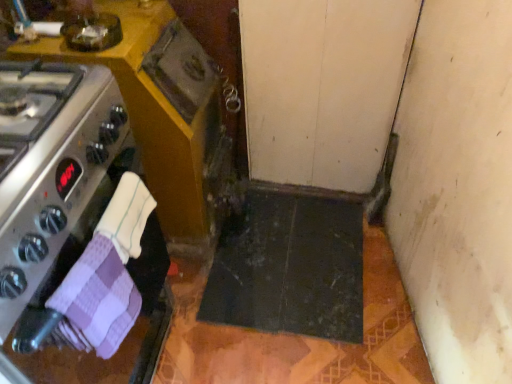
Question: Is matte wood cabinet at lower center at the left side of purple checkered cloth at left, arranged as the 2th hand towel when viewed from the top?

Choices:
 (A) yes
 (B) no

Answer: (A)

Question: Does matte wood cabinet at lower center have a lesser width compared to purple checkered cloth at left, arranged as the 2th hand towel when viewed from the top?

Choices:
 (A) no
 (B) yes

Answer: (A)

Question: Is matte wood cabinet at lower center taller than purple checkered cloth at left, arranged as the 2th hand towel when viewed from the top?

Choices:
 (A) yes
 (B) no

Answer: (A)

Question: Is purple checkered cloth at left, arranged as the 2th hand towel when viewed from the top, a part of matte wood cabinet at lower center?

Choices:
 (A) yes
 (B) no

Answer: (B)

Question: Is matte wood cabinet at lower center positioned in front of purple checkered cloth at left, arranged as the 2th hand towel when viewed from the top?

Choices:
 (A) yes
 (B) no

Answer: (B)

Question: Is matte wood cabinet at lower center turned away from purple checkered cloth at left, which ranks as the 1th hand towel in bottom-to-top order?

Choices:
 (A) yes
 (B) no

Answer: (B)

Question: Is white textured hand towel at lower left, the 1th hand towel from the top, far away from satin silver oven at left?

Choices:
 (A) yes
 (B) no

Answer: (B)

Question: Is white textured hand towel at lower left, the 1th hand towel from the top, in front of satin silver oven at left?

Choices:
 (A) no
 (B) yes

Answer: (A)

Question: Is white textured hand towel at lower left, which appears as the 2th hand towel when ordered from the bottom, beside satin silver oven at left?

Choices:
 (A) no
 (B) yes

Answer: (A)

Question: Is white textured hand towel at lower left, which appears as the 2th hand towel when ordered from the bottom, taller than satin silver oven at left?

Choices:
 (A) yes
 (B) no

Answer: (B)

Question: Is the position of white textured hand towel at lower left, which appears as the 2th hand towel when ordered from the bottom, more distant than that of satin silver oven at left?

Choices:
 (A) no
 (B) yes

Answer: (B)

Question: Does white textured hand towel at lower left, the 1th hand towel from the top, have a lesser width compared to satin silver oven at left?

Choices:
 (A) yes
 (B) no

Answer: (A)

Question: Considering the relative sizes of purple checkered cloth at left, which ranks as the 1th hand towel in bottom-to-top order, and matte wood cabinet at lower center in the image provided, is purple checkered cloth at left, which ranks as the 1th hand towel in bottom-to-top order, shorter than matte wood cabinet at lower center?

Choices:
 (A) yes
 (B) no

Answer: (A)